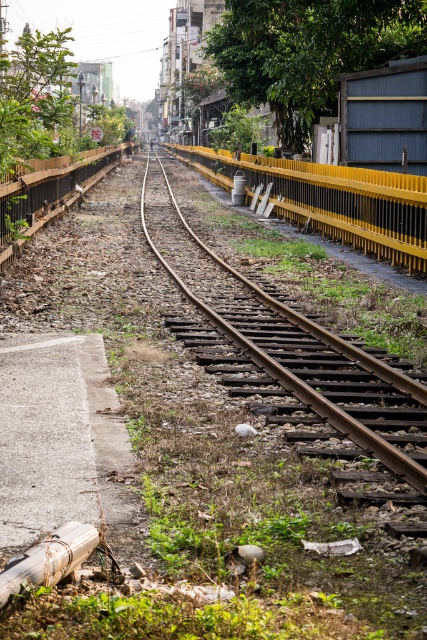
Question: Which object appears farthest from the camera in this image?

Choices:
 (A) green leafy tree at upper left
 (B) rusty metal track at center
 (C) green leafy tree at upper center
 (D) wooden fence at left

Answer: (C)

Question: Which object appears farthest from the camera in this image?

Choices:
 (A) rusty metal track at center
 (B) green leafy tree at upper center
 (C) green leafy tree at upper left
 (D) yellow metal rail at center

Answer: (B)

Question: Which object appears closest to the camera in this image?

Choices:
 (A) green leafy tree at upper center
 (B) green leafy tree at upper left
 (C) yellow metal rail at center
 (D) wooden fence at left

Answer: (B)

Question: Where is yellow metal rail at center located in relation to wooden fence at left in the image?

Choices:
 (A) below
 (B) above

Answer: (A)

Question: In this image, where is green leafy tree at upper center located relative to green leafy tree at upper left?

Choices:
 (A) below
 (B) above

Answer: (A)

Question: In this image, where is yellow metal rail at center located relative to wooden fence at left?

Choices:
 (A) right
 (B) left

Answer: (A)